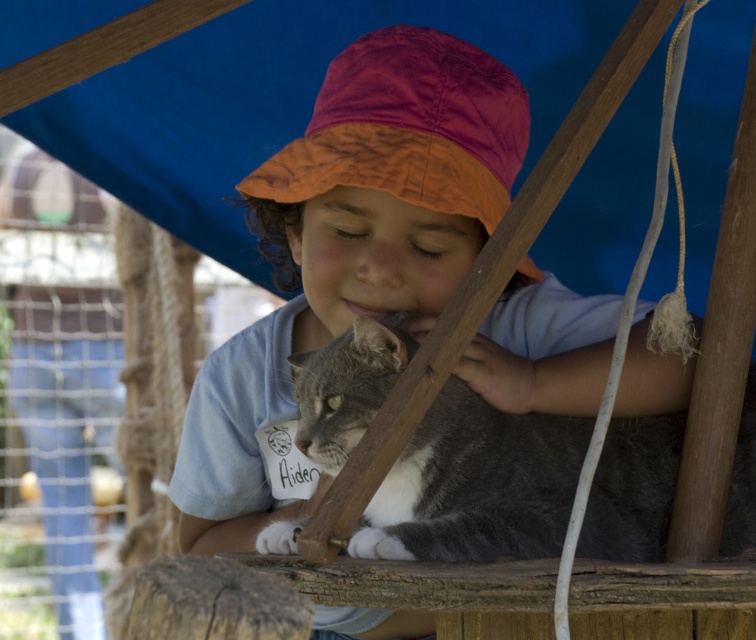
Does matte blue shirt at center appear on the right side of smooth gray cat at center?

Yes, matte blue shirt at center is to the right of smooth gray cat at center.

Can you confirm if matte blue shirt at center is wider than smooth gray cat at center?

Yes.

Describe the element at coordinates (349, 248) in the screenshot. I see `matte blue shirt at center` at that location.

Image resolution: width=756 pixels, height=640 pixels. Find the location of `matte blue shirt at center`. matte blue shirt at center is located at coordinates (349, 248).

Is gray-furred cat at center closer to the viewer compared to smooth gray cat at center?

Yes, gray-furred cat at center is closer to the viewer.

How far apart are gray-furred cat at center and smooth gray cat at center?

The distance of gray-furred cat at center from smooth gray cat at center is 2.22 meters.

The height and width of the screenshot is (640, 756). I want to click on gray-furred cat at center, so click(476, 484).

The image size is (756, 640). Find the location of `gray-furred cat at center`. gray-furred cat at center is located at coordinates (476, 484).

The height and width of the screenshot is (640, 756). Find the location of `matte blue shirt at center`. matte blue shirt at center is located at coordinates (349, 248).